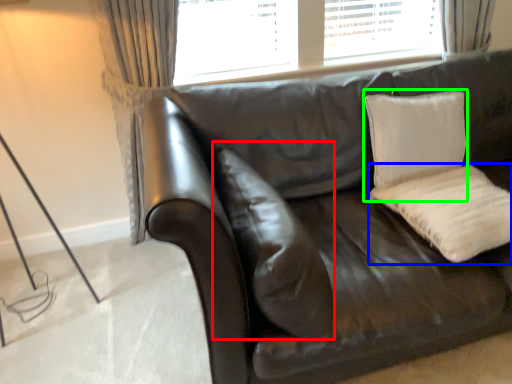
Question: Based on their relative distances, which object is nearer to pillow (highlighted by a red box)? Choose from pillow (highlighted by a blue box) and pillow (highlighted by a green box).

Choices:
 (A) pillow
 (B) pillow

Answer: (A)